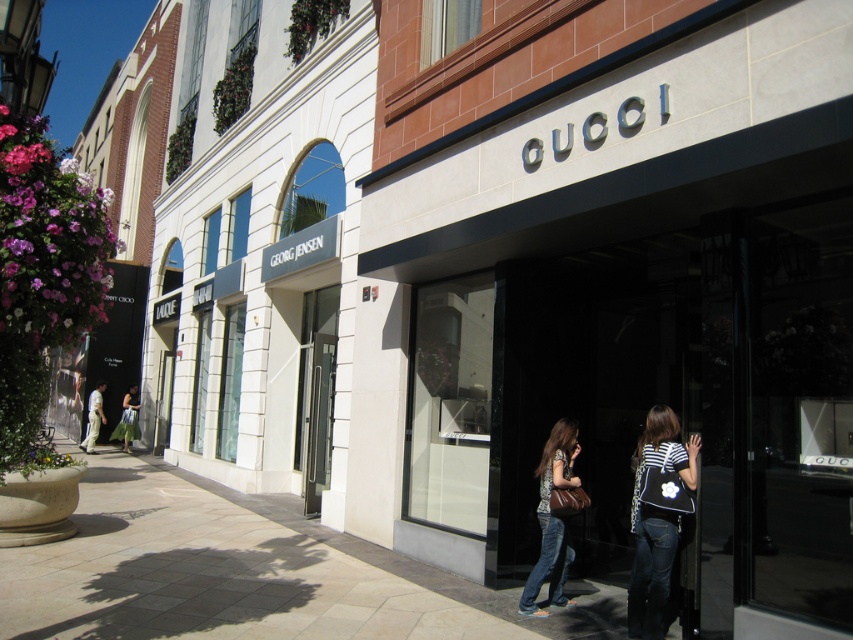
You are a customer standing in front of the Gucci store and see the denim jeans at center and the denim at lower right. Which item is closer to the entrance of the Georg Jensen store located to the left?

The denim jeans at center is closer to the entrance of the Georg Jensen store located to the left because it is positioned to the left of the denim at lower right, and the Georg Jensen store is on the left side of the Gucci store.